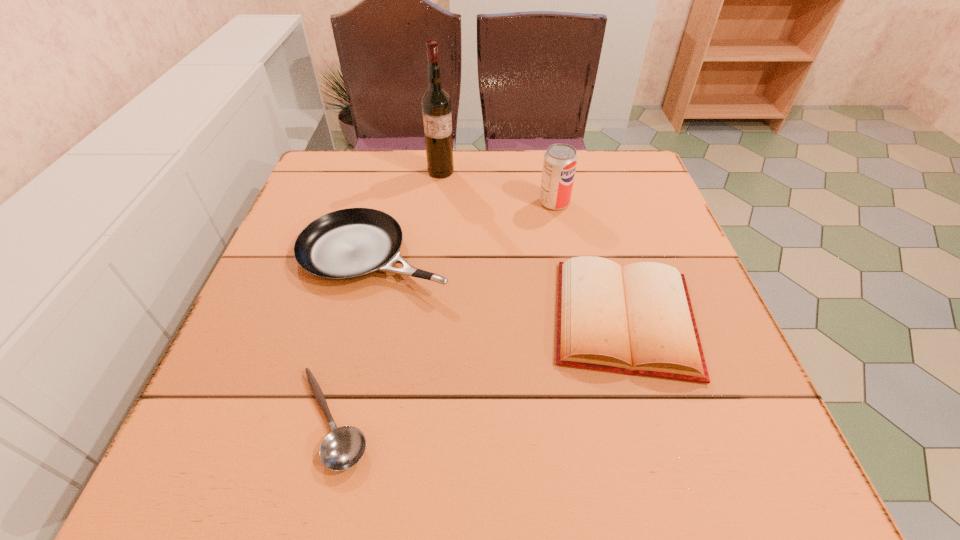
Identify the location of vacant space that satisfies the following two spatial constraints: 1. on the front and back of the fourth tallest object; 2. on the right side of the wine bottle. (424, 318).